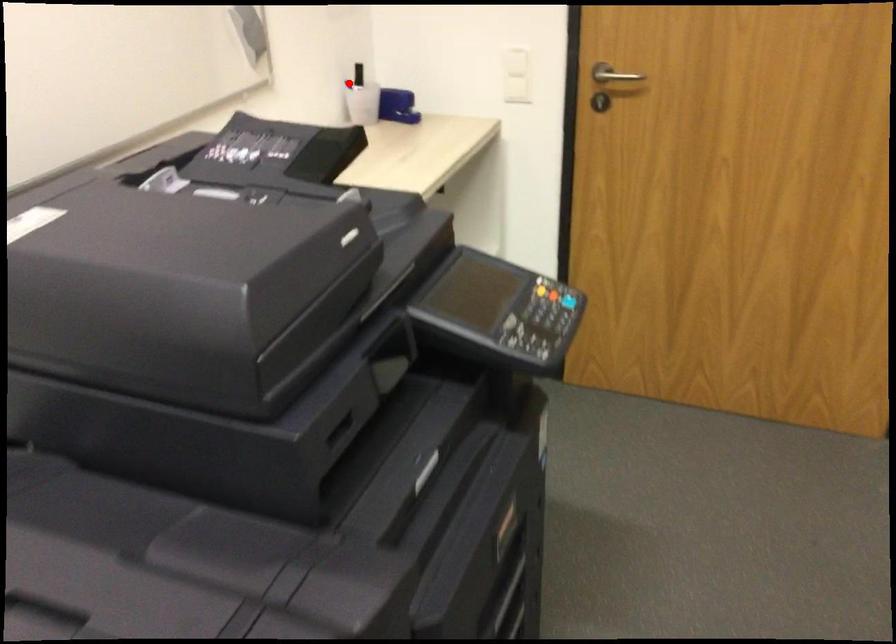
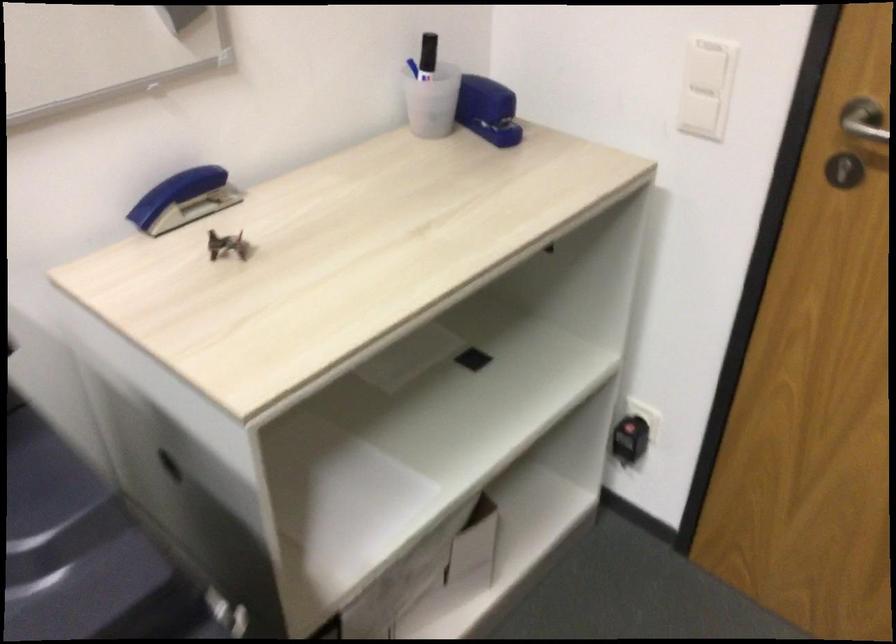
Question: A red point is marked in image1. In image2, is the corresponding 3D point closer to the camera or farther? Reply with the corresponding letter.

Choices:
 (A) The corresponding 3D point is closer.
 (B) The corresponding 3D point is farther.

Answer: (A)